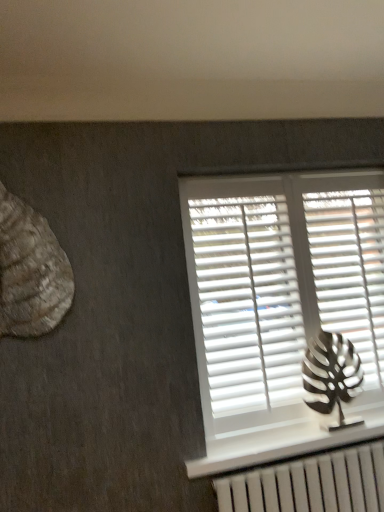
This screenshot has width=384, height=512. I want to click on rustic wood seashell at left, the second animal positioned from the back, so click(30, 271).

What are the coordinates of `white plastic shutters at center, which ranks as the 2th shutter in right-to-left order` in the screenshot? It's located at (248, 302).

Describe the element at coordinates (248, 302) in the screenshot. The width and height of the screenshot is (384, 512). I see `white plastic shutters at center, which ranks as the first shutter in left-to-right order` at that location.

What is the approximate height of metallic silver leaf at right, placed as the second animal when sorted from top to bottom?

metallic silver leaf at right, placed as the second animal when sorted from top to bottom, is 15.81 inches tall.

You are a GUI agent. You are given a task and a screenshot of the screen. Output one action in this format:
    pyautogui.click(x=<x>, y=<y>)
    Task: Click on the white matte blinds at upper right
    The image size is (384, 512).
    Given the screenshot: What is the action you would take?
    pos(280,297)

Can you confirm if white plastic shutters at center, which ranks as the first shutter in left-to-right order, is bigger than metallic silver leaf at right, the second animal viewed from the front?

Correct, white plastic shutters at center, which ranks as the first shutter in left-to-right order, is larger in size than metallic silver leaf at right, the second animal viewed from the front.

Which of these two, white plastic shutters at center, which ranks as the first shutter in left-to-right order, or metallic silver leaf at right, which appears as the 2th animal when viewed from the left, stands shorter?

metallic silver leaf at right, which appears as the 2th animal when viewed from the left, is shorter.

In terms of width, does white plastic shutters at center, which ranks as the first shutter in left-to-right order, look wider or thinner when compared to metallic silver leaf at right, which appears as the 2th animal when viewed from the left?

Considering their sizes, white plastic shutters at center, which ranks as the first shutter in left-to-right order, looks slimmer than metallic silver leaf at right, which appears as the 2th animal when viewed from the left.

Considering the relative positions of white plastic shutters at center, which ranks as the first shutter in left-to-right order, and metallic silver leaf at right, the first animal from the bottom, in the image provided, is white plastic shutters at center, which ranks as the first shutter in left-to-right order, to the left or to the right of metallic silver leaf at right, the first animal from the bottom,?

white plastic shutters at center, which ranks as the first shutter in left-to-right order, is to the left of metallic silver leaf at right, the first animal from the bottom.

Between white plastic shutters at center, which ranks as the first shutter in left-to-right order, and rustic wood seashell at left, the second animal positioned from the back, which one is positioned in front?

rustic wood seashell at left, the second animal positioned from the back.

Is white plastic shutters at center, which ranks as the first shutter in left-to-right order, facing away from rustic wood seashell at left, placed as the 1th animal when sorted from front to back?

→ white plastic shutters at center, which ranks as the first shutter in left-to-right order, does not have its back to rustic wood seashell at left, placed as the 1th animal when sorted from front to back.

Identify the location of animal on the left of white plastic shutters at center, which ranks as the 2th shutter in right-to-left order. (30, 271).

From the image's perspective, would you say white plastic shutters at center, which ranks as the first shutter in left-to-right order, is shown under rustic wood seashell at left, which is the 2th animal in right-to-left order?

Yes, from the image's perspective, white plastic shutters at center, which ranks as the first shutter in left-to-right order, is below rustic wood seashell at left, which is the 2th animal in right-to-left order.

Does white matte blinds at upper right touch rustic wood seashell at left, the first animal from the top?

There is a gap between white matte blinds at upper right and rustic wood seashell at left, the first animal from the top.

Starting from the white matte blinds at upper right, which animal is the 2nd one in front? Please provide its 2D coordinates.

[(30, 271)]

Is white matte blinds at upper right completely or partially outside of rustic wood seashell at left, which is the 2th animal in right-to-left order?

Yes, white matte blinds at upper right is outside of rustic wood seashell at left, which is the 2th animal in right-to-left order.

Would you say white matte blinds at upper right is to the left or to the right of rustic wood seashell at left, the second animal positioned from the back, in the picture?

Clearly, white matte blinds at upper right is on the right of rustic wood seashell at left, the second animal positioned from the back, in the image.

In the scene shown: Is metallic silver leaf at right, which appears as the 2th animal when viewed from the left, oriented towards white plastic shutters at center, which ranks as the first shutter in left-to-right order?

No.

Does metallic silver leaf at right, placed as the first animal when sorted from right to left, have a lesser width compared to white plastic shutters at center, which ranks as the first shutter in left-to-right order?

No, metallic silver leaf at right, placed as the first animal when sorted from right to left, is not thinner than white plastic shutters at center, which ranks as the first shutter in left-to-right order.

Considering the sizes of metallic silver leaf at right, the second animal viewed from the front, and white plastic shutters at center, which ranks as the first shutter in left-to-right order, in the image, is metallic silver leaf at right, the second animal viewed from the front, taller or shorter than white plastic shutters at center, which ranks as the first shutter in left-to-right order,?

Clearly, metallic silver leaf at right, the second animal viewed from the front, is shorter compared to white plastic shutters at center, which ranks as the first shutter in left-to-right order.

Based on the photo, from a real-world perspective, is metallic silver leaf at right, the second animal viewed from the front, physically above white plastic shutters at center, which ranks as the first shutter in left-to-right order?

No, from a real-world perspective, metallic silver leaf at right, the second animal viewed from the front, is not over white plastic shutters at center, which ranks as the first shutter in left-to-right order

Does white plastic shutters at center, which ranks as the 2th shutter in right-to-left order, have a smaller size compared to white matte shutter at right, which is the first shutter in right-to-left order?

No.

From the image's perspective, would you say white plastic shutters at center, which ranks as the 2th shutter in right-to-left order, is positioned over white matte shutter at right, marked as the 2th shutter in a left-to-right arrangement?

No.

From a real-world perspective, which object rests below the other?

white plastic shutters at center, which ranks as the 2th shutter in right-to-left order, from a real-world perspective.

Is rustic wood seashell at left, which is counted as the second animal, starting from the bottom, positioned beyond the bounds of white matte shutter at right, which is the first shutter in right-to-left order?

rustic wood seashell at left, which is counted as the second animal, starting from the bottom, lies outside white matte shutter at right, which is the first shutter in right-to-left order,'s area.

Which object is further away from the camera, rustic wood seashell at left, which is counted as the second animal, starting from the bottom, or white matte shutter at right, marked as the 2th shutter in a left-to-right arrangement?

Positioned behind is white matte shutter at right, marked as the 2th shutter in a left-to-right arrangement.

Which is nearer, (23, 251) or (312, 242)?

Point (23, 251)

Can you confirm if white matte blinds at upper right is wider than metallic silver leaf at right, the first animal from the bottom?

No, white matte blinds at upper right is not wider than metallic silver leaf at right, the first animal from the bottom.

Is white matte blinds at upper right not inside metallic silver leaf at right, placed as the second animal when sorted from top to bottom?

Absolutely, white matte blinds at upper right is external to metallic silver leaf at right, placed as the second animal when sorted from top to bottom.

Are white matte blinds at upper right and metallic silver leaf at right, placed as the first animal when sorted from right to left, beside each other?

No, white matte blinds at upper right is not beside metallic silver leaf at right, placed as the first animal when sorted from right to left.

How different are the orientations of white matte blinds at upper right and metallic silver leaf at right, placed as the first animal when sorted from right to left, in degrees?

white matte blinds at upper right and metallic silver leaf at right, placed as the first animal when sorted from right to left, are facing 0.00279 degrees away from each other.

Where is `animal below the white plastic shutters at center, which ranks as the 2th shutter in right-to-left order (from a real-world perspective)`? animal below the white plastic shutters at center, which ranks as the 2th shutter in right-to-left order (from a real-world perspective) is located at coordinates (331, 376).

Where is `animal lying on the left of white plastic shutters at center, which ranks as the 2th shutter in right-to-left order`? This screenshot has height=512, width=384. animal lying on the left of white plastic shutters at center, which ranks as the 2th shutter in right-to-left order is located at coordinates (30, 271).

Estimate the real-world distances between objects in this image. Which object is closer to white plastic shutters at center, which ranks as the first shutter in left-to-right order, white matte blinds at upper right or rustic wood seashell at left, which ranks as the first animal in left-to-right order?

The object closer to white plastic shutters at center, which ranks as the first shutter in left-to-right order, is white matte blinds at upper right.

Based on the photo, based on their spatial positions, is white matte shutter at right, marked as the 2th shutter in a left-to-right arrangement, or white matte blinds at upper right closer to metallic silver leaf at right, which appears as the 2th animal when viewed from the left?

The object closer to metallic silver leaf at right, which appears as the 2th animal when viewed from the left, is white matte shutter at right, marked as the 2th shutter in a left-to-right arrangement.

Based on their spatial positions, is rustic wood seashell at left, the second animal positioned from the back, or white matte shutter at right, which is the first shutter in right-to-left order, further from white matte blinds at upper right?

rustic wood seashell at left, the second animal positioned from the back, is further to white matte blinds at upper right.

Considering their positions, is white plastic shutters at center, which ranks as the 2th shutter in right-to-left order, positioned closer to rustic wood seashell at left, which is the 2th animal in right-to-left order, than metallic silver leaf at right, marked as the first animal in a back-to-front arrangement?

Based on the image, white plastic shutters at center, which ranks as the 2th shutter in right-to-left order, appears to be nearer to rustic wood seashell at left, which is the 2th animal in right-to-left order.

Estimate the real-world distances between objects in this image. Which object is closer to white matte blinds at upper right, white matte shutter at right, which is the first shutter in right-to-left order, or metallic silver leaf at right, the first animal from the bottom?

white matte shutter at right, which is the first shutter in right-to-left order, is positioned closer to the anchor white matte blinds at upper right.

Considering their positions, is white plastic shutters at center, which ranks as the first shutter in left-to-right order, positioned further to white matte shutter at right, marked as the 2th shutter in a left-to-right arrangement, than white matte blinds at upper right?

Among the two, white plastic shutters at center, which ranks as the first shutter in left-to-right order, is located further to white matte shutter at right, marked as the 2th shutter in a left-to-right arrangement.

Based on their spatial positions, is rustic wood seashell at left, which is counted as the second animal, starting from the bottom, or white matte blinds at upper right further from white matte shutter at right, which is the first shutter in right-to-left order?

Based on the image, rustic wood seashell at left, which is counted as the second animal, starting from the bottom, appears to be further to white matte shutter at right, which is the first shutter in right-to-left order.

From the image, which object appears to be nearer to rustic wood seashell at left, placed as the 1th animal when sorted from front to back, metallic silver leaf at right, placed as the second animal when sorted from top to bottom, or white matte blinds at upper right?

The object closer to rustic wood seashell at left, placed as the 1th animal when sorted from front to back, is white matte blinds at upper right.

Where is `shutter between white matte blinds at upper right and metallic silver leaf at right, the second animal viewed from the front, from top to bottom`? This screenshot has width=384, height=512. shutter between white matte blinds at upper right and metallic silver leaf at right, the second animal viewed from the front, from top to bottom is located at coordinates (248, 302).

The image size is (384, 512). I want to click on animal between white plastic shutters at center, which ranks as the first shutter in left-to-right order, and white matte shutter at right, marked as the 2th shutter in a left-to-right arrangement, from left to right, so click(x=331, y=376).

You are a GUI agent. You are given a task and a screenshot of the screen. Output one action in this format:
    pyautogui.click(x=<x>, y=<y>)
    Task: Click on the window between rustic wood seashell at left, the second animal positioned from the back, and metallic silver leaf at right, placed as the first animal when sorted from right to left, from left to right
    
    Given the screenshot: What is the action you would take?
    pyautogui.click(x=280, y=297)

Find the location of `shutter situated between rustic wood seashell at left, which ranks as the first animal in left-to-right order, and white matte blinds at upper right from left to right`. shutter situated between rustic wood seashell at left, which ranks as the first animal in left-to-right order, and white matte blinds at upper right from left to right is located at coordinates (248, 302).